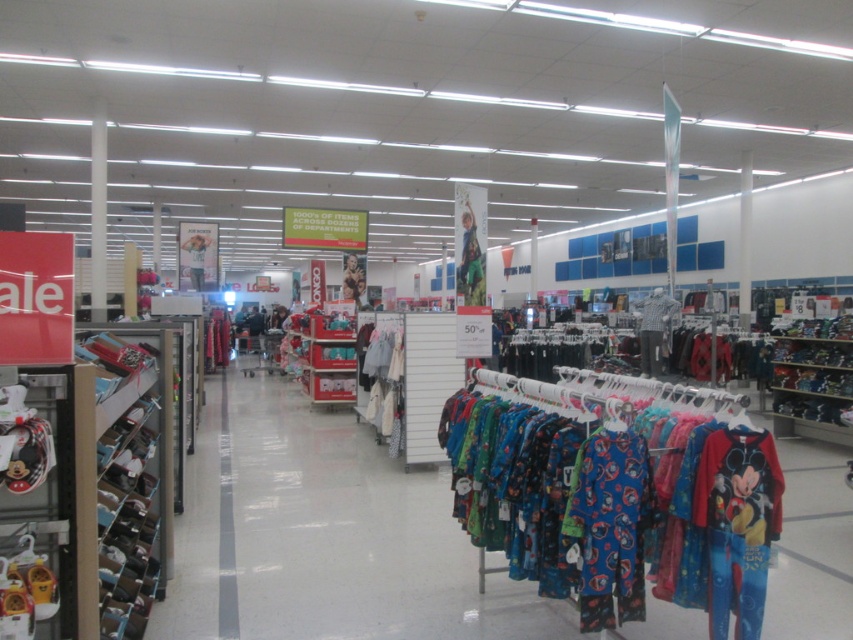
Question: Which of the following is the farthest from the observer?

Choices:
 (A) metallic mickey mouse ears at left
 (B) metallic silver shoes at left
 (C) blue fleece pajamas at center

Answer: (C)

Question: Which object is farther from the camera taking this photo?

Choices:
 (A) blue fleece pajamas at center
 (B) white cotton shirt at center
 (C) metallic mickey mouse ears at left

Answer: (B)

Question: Can you confirm if metallic silver shoes at left is wider than blue fleece pajamas at center?

Choices:
 (A) yes
 (B) no

Answer: (A)

Question: In this image, where is blue cotton pajamas at center located relative to metallic silver shoes at left?

Choices:
 (A) above
 (B) below

Answer: (A)

Question: Can you confirm if metallic silver shoes at left is smaller than blue fleece pajamas at center?

Choices:
 (A) no
 (B) yes

Answer: (A)

Question: Which object is closer to the camera taking this photo?

Choices:
 (A) metallic mickey mouse ears at left
 (B) blue fleece pajamas at center
 (C) blue cotton pajamas at center
 (D) metallic silver shoes at left

Answer: (A)